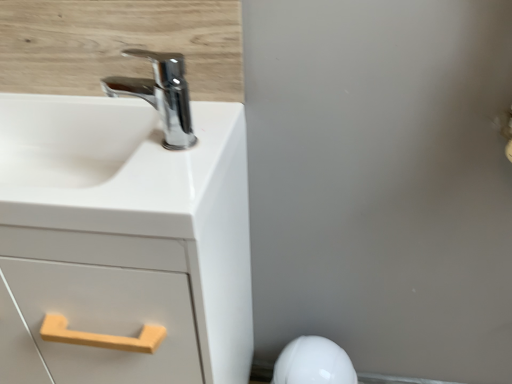
Question: From a real-world perspective, does white glossy sink at upper left stand above white glossy porcelain at lower right?

Choices:
 (A) yes
 (B) no

Answer: (A)

Question: Could you tell me if white glossy sink at upper left is facing white glossy porcelain at lower right?

Choices:
 (A) no
 (B) yes

Answer: (A)

Question: Is white glossy sink at upper left thinner than white glossy porcelain at lower right?

Choices:
 (A) yes
 (B) no

Answer: (B)

Question: Is white glossy sink at upper left positioned behind white glossy porcelain at lower right?

Choices:
 (A) no
 (B) yes

Answer: (A)

Question: From the image's perspective, is white glossy sink at upper left below white glossy porcelain at lower right?

Choices:
 (A) no
 (B) yes

Answer: (A)

Question: Is white glossy sink at upper left far from white glossy porcelain at lower right?

Choices:
 (A) no
 (B) yes

Answer: (A)

Question: Would you say white glossy porcelain at lower right contains white matte cabinet at left?

Choices:
 (A) no
 (B) yes

Answer: (A)

Question: Is white glossy porcelain at lower right bigger than white matte cabinet at left?

Choices:
 (A) yes
 (B) no

Answer: (B)

Question: Can you confirm if white glossy porcelain at lower right is positioned to the right of white matte cabinet at left?

Choices:
 (A) yes
 (B) no

Answer: (A)

Question: Is white glossy porcelain at lower right in contact with white matte cabinet at left?

Choices:
 (A) no
 (B) yes

Answer: (A)

Question: From the image's perspective, is white glossy porcelain at lower right over white matte cabinet at left?

Choices:
 (A) yes
 (B) no

Answer: (B)

Question: Is white glossy porcelain at lower right outside of white matte cabinet at left?

Choices:
 (A) no
 (B) yes

Answer: (B)

Question: Is white matte cabinet at left turned away from chrome/metallic faucet at upper left?

Choices:
 (A) no
 (B) yes

Answer: (A)